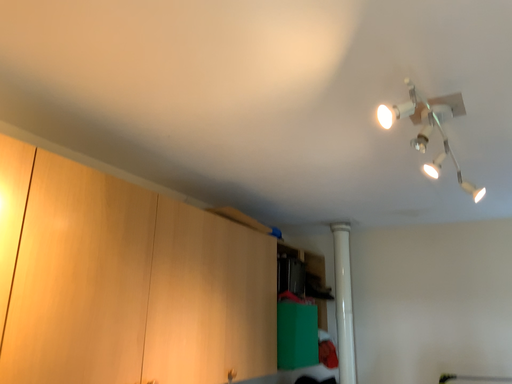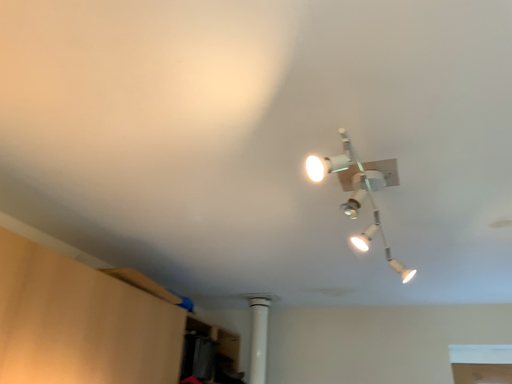
Question: Which way did the camera rotate in the video?

Choices:
 (A) rotated downward
 (B) rotated upward

Answer: (B)